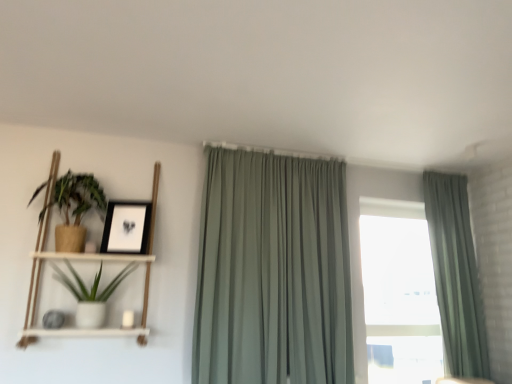
Where is `vacant space situated above sage green fabric curtain at center, acting as the first curtain starting from the left (from a real-world perspective)`? The width and height of the screenshot is (512, 384). vacant space situated above sage green fabric curtain at center, acting as the first curtain starting from the left (from a real-world perspective) is located at coordinates (287, 152).